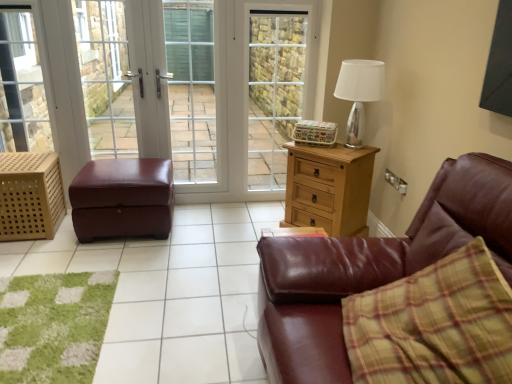
Locate an element on the screen. vacant space in front of burgundy leather ottoman at left is located at coordinates (105, 267).